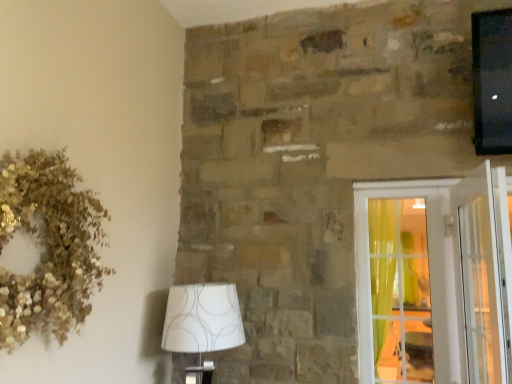
Question: Should I look upward or downward to see clear glass screen door at right?

Choices:
 (A) up
 (B) down

Answer: (B)

Question: Does gold glitter wreath at upper left appear on the right side of white fabric lampshade at lower left?

Choices:
 (A) yes
 (B) no

Answer: (B)

Question: Does gold glitter wreath at upper left have a lesser width compared to white fabric lampshade at lower left?

Choices:
 (A) no
 (B) yes

Answer: (B)

Question: Is gold glitter wreath at upper left further to camera compared to white fabric lampshade at lower left?

Choices:
 (A) no
 (B) yes

Answer: (A)

Question: Is gold glitter wreath at upper left taller than white fabric lampshade at lower left?

Choices:
 (A) no
 (B) yes

Answer: (B)

Question: Is gold glitter wreath at upper left not within white fabric lampshade at lower left?

Choices:
 (A) yes
 (B) no

Answer: (A)

Question: Is gold glitter wreath at upper left not near white fabric lampshade at lower left?

Choices:
 (A) no
 (B) yes

Answer: (A)

Question: Is clear glass screen door at right outside white fabric lampshade at lower left?

Choices:
 (A) yes
 (B) no

Answer: (A)

Question: From a real-world perspective, is clear glass screen door at right under white fabric lampshade at lower left?

Choices:
 (A) no
 (B) yes

Answer: (A)

Question: Considering the relative sizes of clear glass screen door at right and white fabric lampshade at lower left in the image provided, is clear glass screen door at right wider than white fabric lampshade at lower left?

Choices:
 (A) no
 (B) yes

Answer: (A)

Question: From the image's perspective, is clear glass screen door at right under white fabric lampshade at lower left?

Choices:
 (A) no
 (B) yes

Answer: (A)

Question: Is the depth of clear glass screen door at right less than that of white fabric lampshade at lower left?

Choices:
 (A) no
 (B) yes

Answer: (B)

Question: Is clear glass screen door at right oriented towards white fabric lampshade at lower left?

Choices:
 (A) no
 (B) yes

Answer: (A)

Question: Is clear glass door at right thinner than white fabric lampshade at lower left?

Choices:
 (A) yes
 (B) no

Answer: (A)